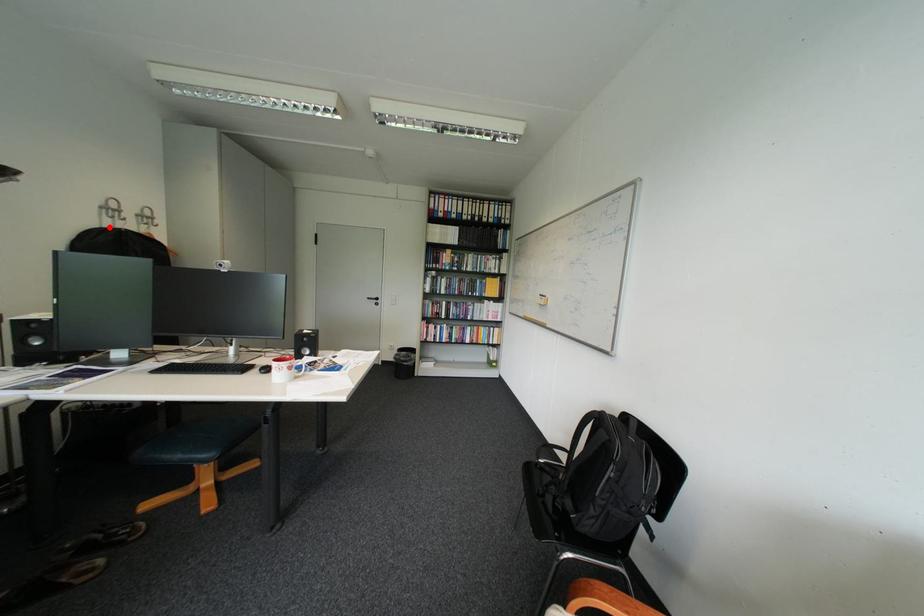
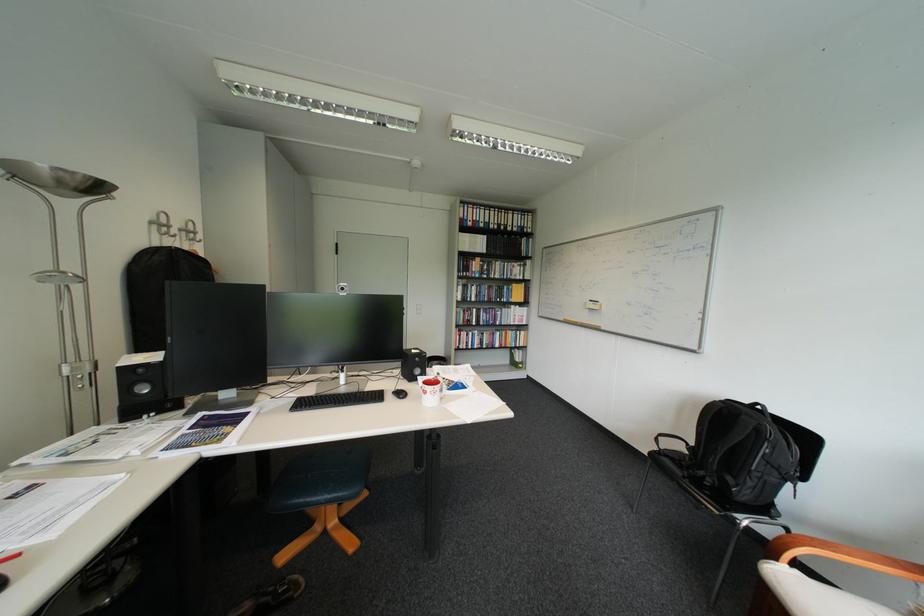
Where in the second image is the point corresponding to the highlighted location from the first image?

(160, 246)